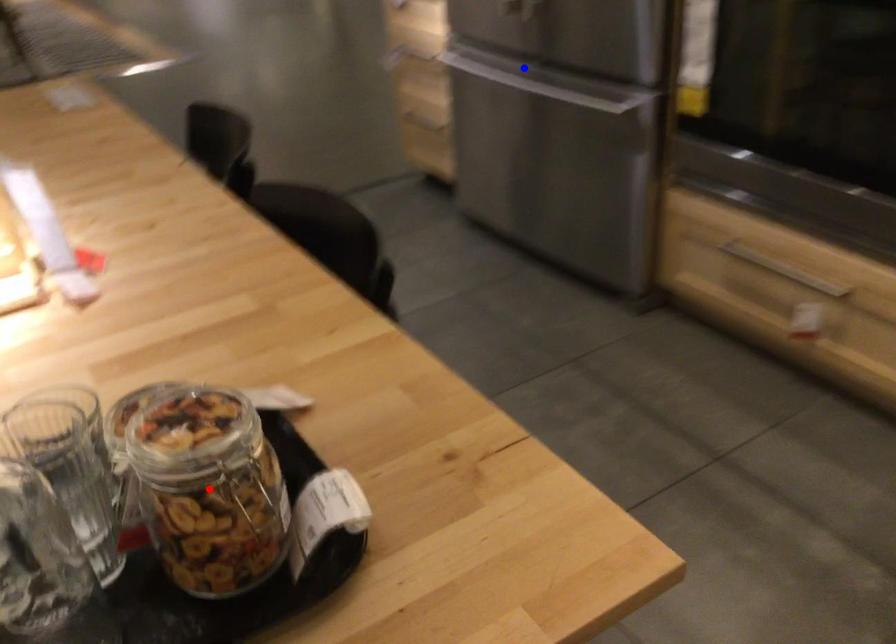
Question: In the image, two points are highlighted. Which point is nearer to the camera? Reply with the corresponding letter.

Choices:
 (A) blue point
 (B) red point

Answer: (B)